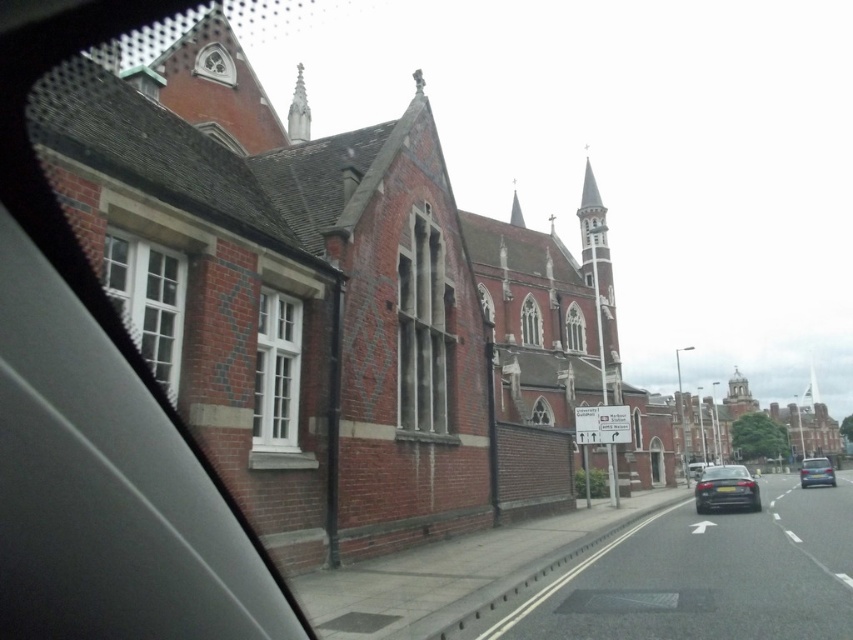
You are a passenger in a car and want to know which of the two points, point (405, 260) or point (799, 465), is closer to you. Based on the scene description, which point is nearer?

Point (405, 260) is closer to the camera than point (799, 465), so it is nearer to you as a passenger in the car.